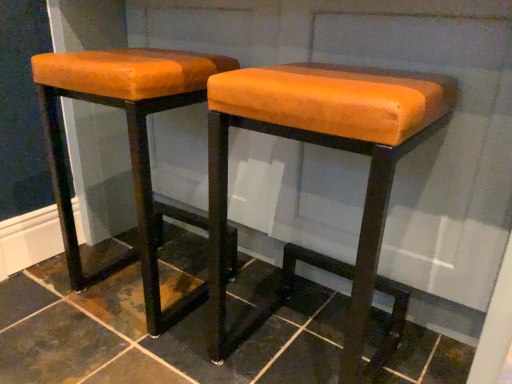
Where is `vacant region above orange leather stool at center, the first stool in the right-to-left sequence (from a real-world perspective)`? Image resolution: width=512 pixels, height=384 pixels. vacant region above orange leather stool at center, the first stool in the right-to-left sequence (from a real-world perspective) is located at coordinates (336, 76).